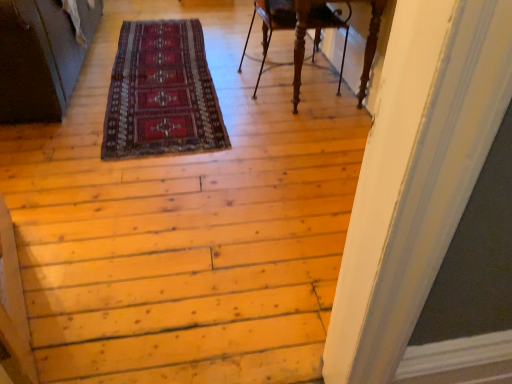
Find the location of `vacant space in front of wooden carved chair at upper center`. vacant space in front of wooden carved chair at upper center is located at coordinates (295, 115).